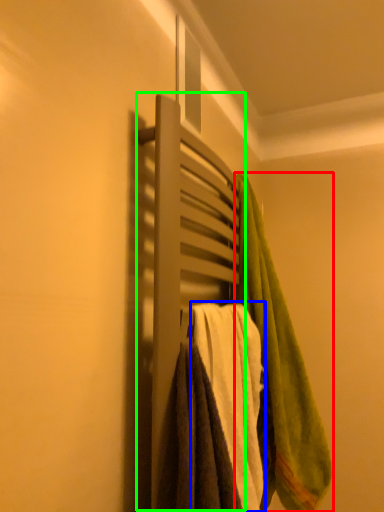
Question: Estimate the real-world distances between objects in this image. Which object is closer to towel (highlighted by a red box), towel (highlighted by a blue box) or closet (highlighted by a green box)?

Choices:
 (A) towel
 (B) closet

Answer: (A)